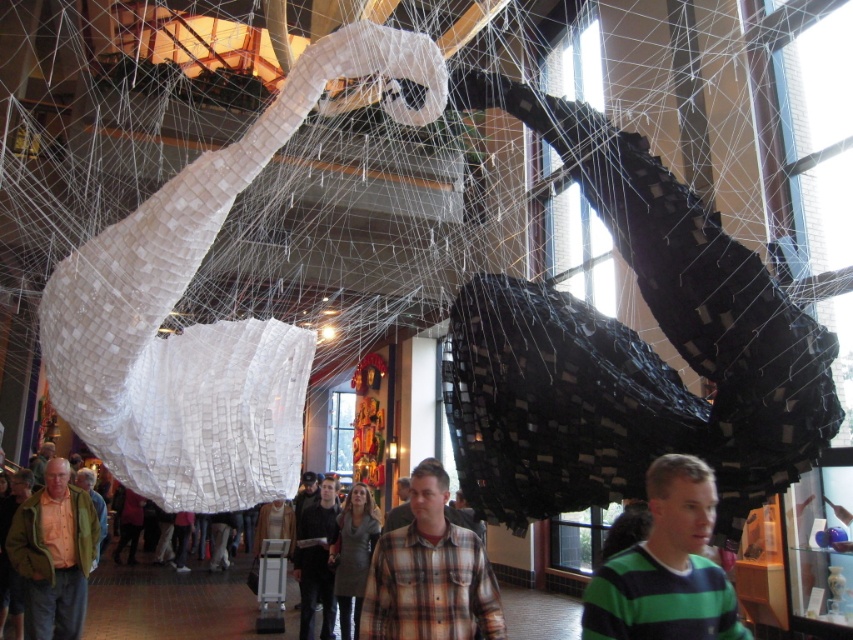
You are an art curator standing 5 meters away from the camera position. You want to pick up the green striped sweater at center. Can you reach it without moving closer?

The green striped sweater at center is 4.86 meters from the camera. Since you are standing 5 meters away from the camera position, you are 9.86 meters away from the sweater. Therefore, you cannot reach it without moving closer.

You are an art curator standing in the installation and notice two items at the center of the room. Which one is closer to you, the plaid shirt at center or the green textured jacket at center?

The plaid shirt at center is closer to you because it is in front of the green textured jacket at center.

You are an artist who wants to place a new sculpture between the green striped sweater at center and the light brown leather jacket at lower left. Based on their positions, which object should the sculpture be closer to?

The sculpture should be placed closer to the light brown leather jacket at lower left because the green striped sweater at center is positioned over it, indicating it is above and closer to the viewer.